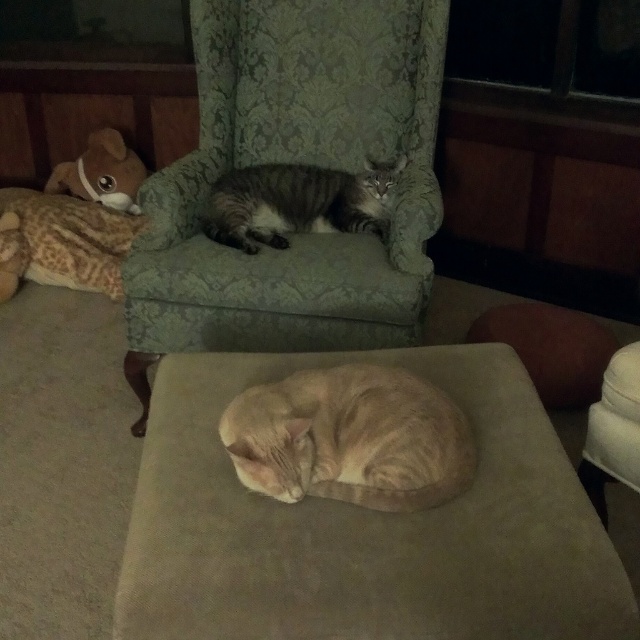
Is green damask armchair at upper center thinner than orange tabby cat at lower center?

No.

Between green damask armchair at upper center and orange tabby cat at lower center, which one has less height?

Standing shorter between the two is orange tabby cat at lower center.

What do you see at coordinates (298, 161) in the screenshot? The image size is (640, 640). I see `green damask armchair at upper center` at bounding box center [298, 161].

Identify the location of green damask armchair at upper center. (298, 161).

Who is positioned more to the right, green damask armchair at upper center or gray striped cat at center?

From the viewer's perspective, gray striped cat at center appears more on the right side.

In the scene shown: Can you confirm if green damask armchair at upper center is positioned below gray striped cat at center?

No, green damask armchair at upper center is not below gray striped cat at center.

Between point (417, 141) and point (248, 202), which one is positioned behind?

Point (417, 141)

Where is `green damask armchair at upper center`? The width and height of the screenshot is (640, 640). green damask armchair at upper center is located at coordinates (298, 161).

Is point (371, 164) farther from camera compared to point (81, 196)?

No, (371, 164) is closer to viewer.

The height and width of the screenshot is (640, 640). I want to click on gray striped cat at center, so (x=298, y=202).